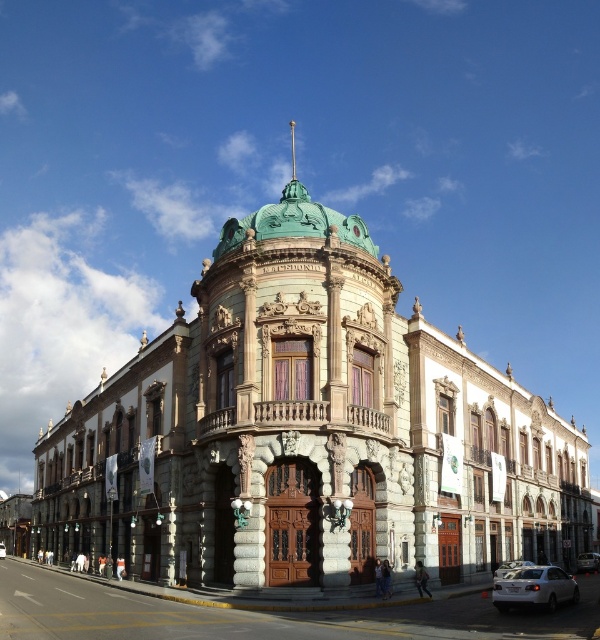
You are a tour guide explaining the vehicles parked in front of the grand building. You need to mention both the satin silver sedan at center and the white glossy car at center. Which one is narrower?

The satin silver sedan at center is thinner than the white glossy car at center, so the satin silver sedan at center is narrower.